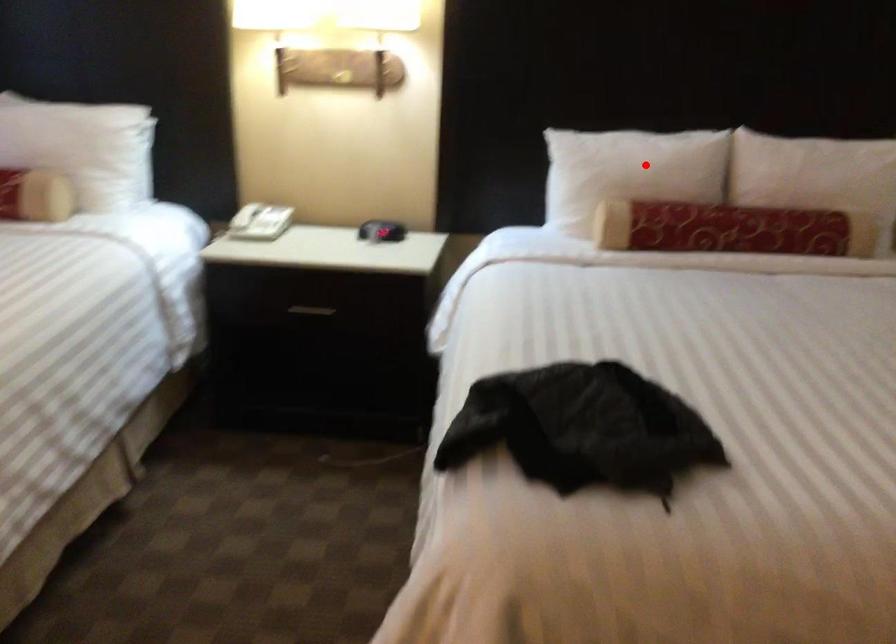
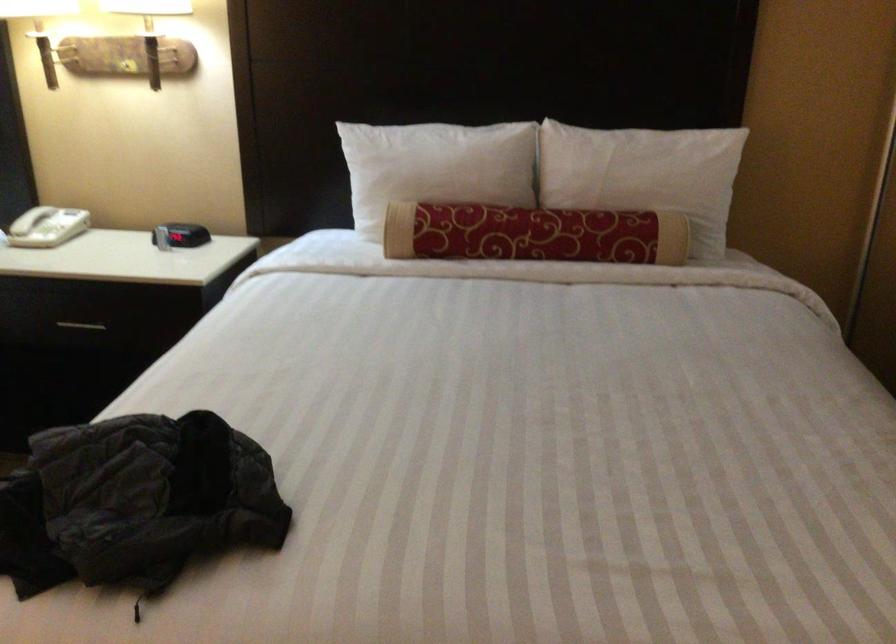
Question: I am providing you with two images of the same scene from different viewpoints. A red point is marked on the first image. Is the red point's position out of view in image 2?

Choices:
 (A) Yes
 (B) No

Answer: (B)